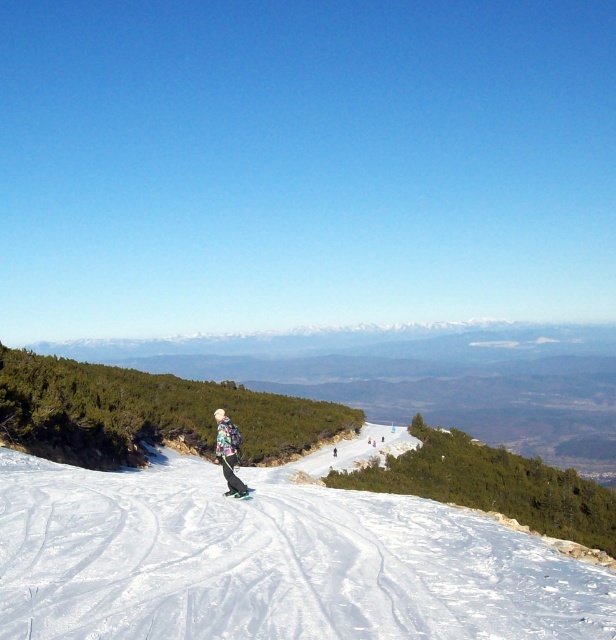
Is white powdery snow at center to the right of green matte ski at center from the viewer's perspective?

In fact, white powdery snow at center is to the left of green matte ski at center.

Is white powdery snow at center above green matte ski at center?

No, white powdery snow at center is not above green matte ski at center.

This screenshot has height=640, width=616. I want to click on white powdery snow at center, so click(x=272, y=561).

Between white powdery snow at center and multicolored snowboard at center, which one is positioned higher?

Positioned higher is multicolored snowboard at center.

What are the coordinates of `white powdery snow at center` in the screenshot? It's located at (272, 561).

Identify the location of multicolored snowboard at center. (229, 452).

Does point (224, 417) come farther from viewer compared to point (232, 467)?

Yes, point (224, 417) is farther from viewer.

Measure the distance between point (232, 484) and camera.

23.25 meters

You are a GUI agent. You are given a task and a screenshot of the screen. Output one action in this format:
    pyautogui.click(x=<x>, y=<y>)
    Task: Click on the multicolored snowboard at center
    
    Given the screenshot: What is the action you would take?
    pyautogui.click(x=229, y=452)